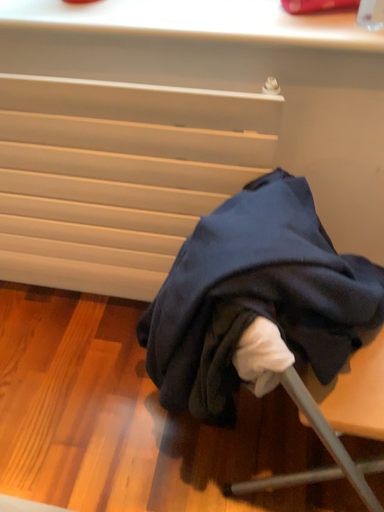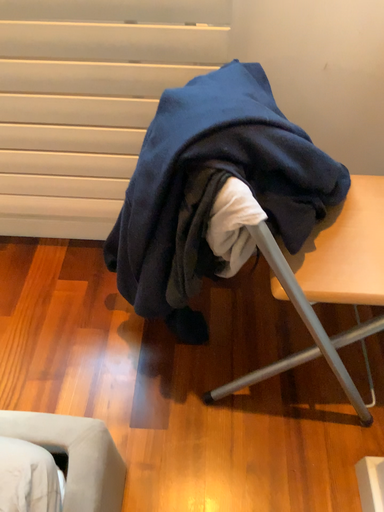
Question: How did the camera likely rotate when shooting the video?

Choices:
 (A) rotated left
 (B) rotated right

Answer: (B)